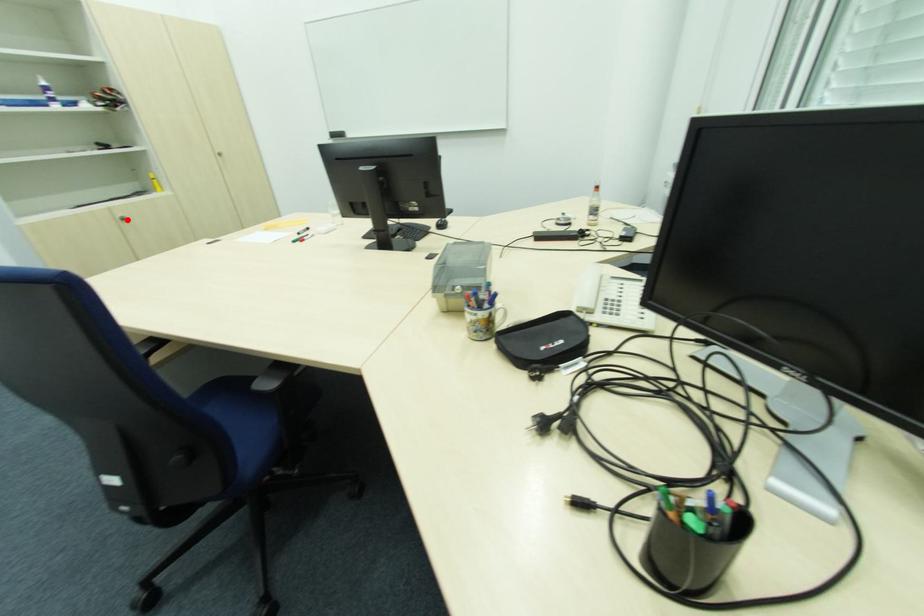
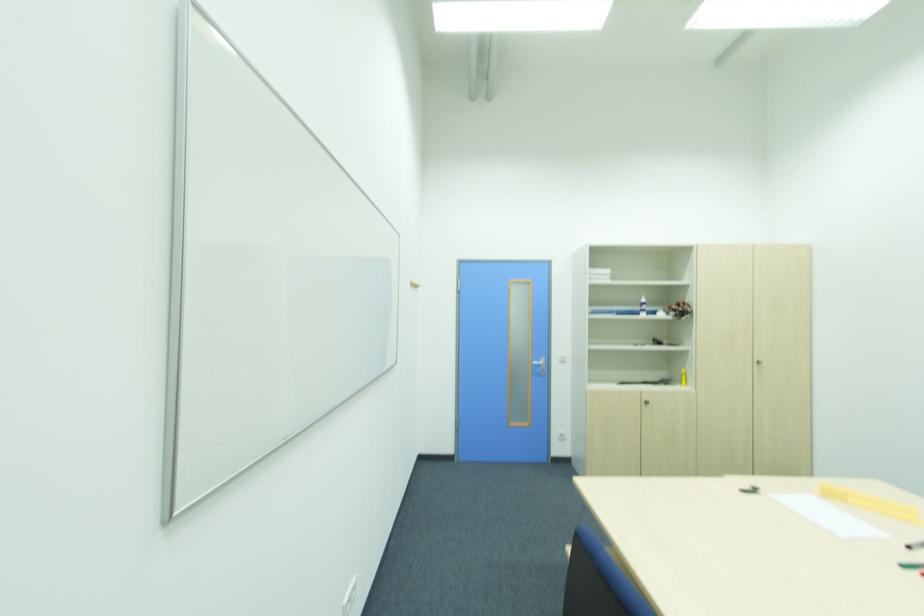
In the second image, find the point that corresponds to the highlighted location in the first image.

(650, 402)